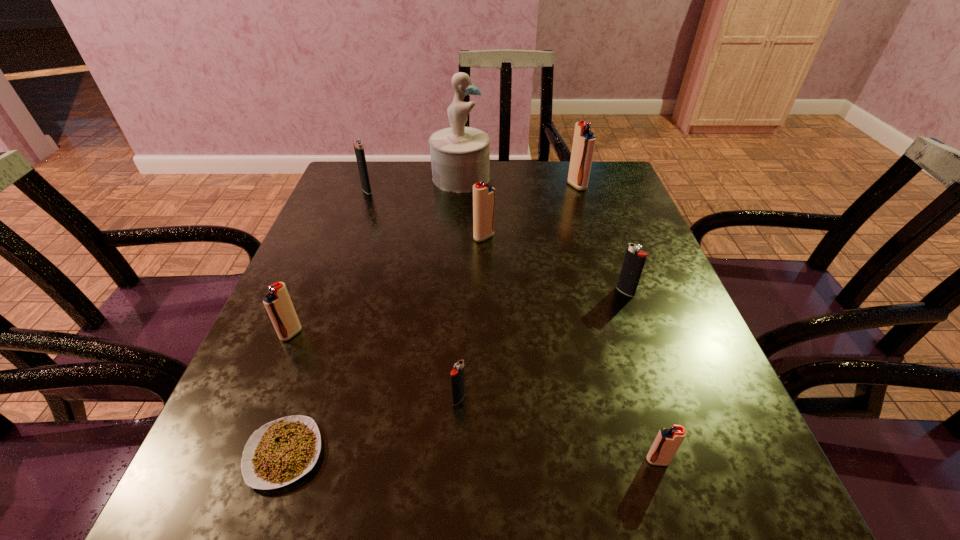
Where is `the third closest black igniter to the smallest red igniter`? the third closest black igniter to the smallest red igniter is located at coordinates (358, 144).

Identify the location of vacant space that satisfies the following two spatial constraints: 1. at the beak of the figurine; 2. on the back side of the fourth igniter from right to left. (457, 237).

The height and width of the screenshot is (540, 960). Identify the location of vacant space that satisfies the following two spatial constraints: 1. on the back side of the second nearest black igniter; 2. at the beak of the white figurine. (586, 178).

This screenshot has height=540, width=960. Find the location of `vacant region that satisfies the following two spatial constraints: 1. on the front side of the nearest igniter; 2. on the left side of the seventh farthest object`. vacant region that satisfies the following two spatial constraints: 1. on the front side of the nearest igniter; 2. on the left side of the seventh farthest object is located at coordinates (456, 461).

Image resolution: width=960 pixels, height=540 pixels. In order to click on vacant region that satisfies the following two spatial constraints: 1. on the back side of the third nearest red igniter; 2. at the beak of the tallest object in this screenshot , I will do `click(483, 178)`.

Find the location of a particular element. The height and width of the screenshot is (540, 960). free spot that satisfies the following two spatial constraints: 1. on the back side of the smallest red igniter; 2. at the beak of the white figurine is located at coordinates (571, 178).

The width and height of the screenshot is (960, 540). What are the coordinates of `vacant space that satisfies the following two spatial constraints: 1. on the front side of the fifth nearest object; 2. on the right side of the second biggest red igniter` in the screenshot? It's located at (485, 292).